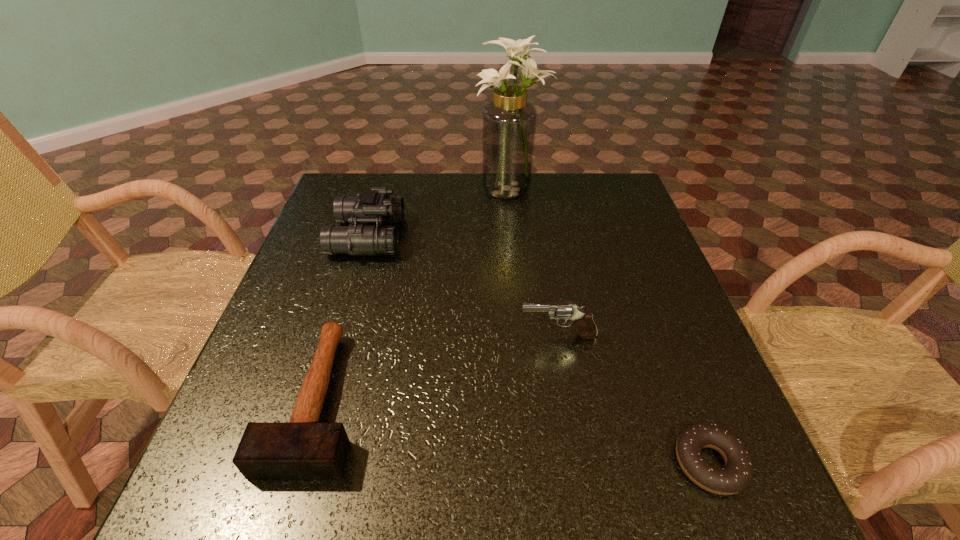
Where is `flower arrangement`? The width and height of the screenshot is (960, 540). flower arrangement is located at coordinates (509, 121).

Where is `the farthest object`? Image resolution: width=960 pixels, height=540 pixels. the farthest object is located at coordinates click(x=509, y=121).

You are a GUI agent. You are given a task and a screenshot of the screen. Output one action in this format:
    pyautogui.click(x=<x>, y=<y>)
    Task: Click on the binoculars
    
    Given the screenshot: What is the action you would take?
    pyautogui.click(x=375, y=206)

At what (x,y) coordinates should I click in order to perform the action: click on the second tallest object. Please return your answer as a coordinate pair (x, y). The height and width of the screenshot is (540, 960). Looking at the image, I should click on (375, 206).

Identify the location of the third shortest object. (583, 319).

You are a GUI agent. You are given a task and a screenshot of the screen. Output one action in this format:
    pyautogui.click(x=<x>, y=<y>)
    Task: Click on the mallet
    
    Given the screenshot: What is the action you would take?
    pyautogui.click(x=303, y=448)

Where is `the rightmost object`? The width and height of the screenshot is (960, 540). the rightmost object is located at coordinates click(x=736, y=475).

Where is `the shortest object`? This screenshot has height=540, width=960. the shortest object is located at coordinates (736, 475).

The image size is (960, 540). In order to click on vacant space situated 0.110m on the front of the flower arrangement in this screenshot , I will do `click(515, 227)`.

I want to click on free space located 0.390m through the lenses of the fourth nearest object, so click(548, 236).